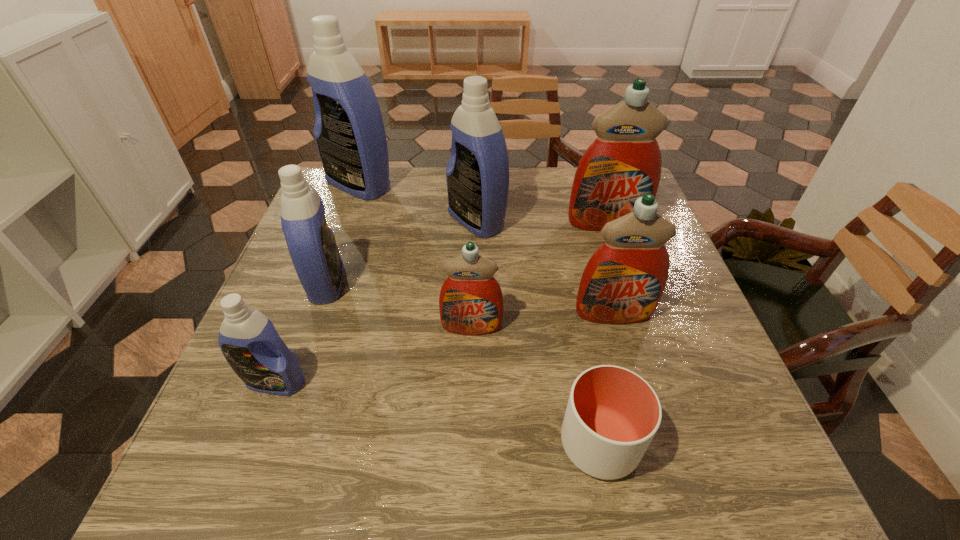
You are a GUI agent. You are given a task and a screenshot of the screen. Output one action in this format:
    pyautogui.click(x=<x>, y=<y>)
    Task: Click on the object that is positioned at the far left corner
    The height and width of the screenshot is (540, 960).
    Given the screenshot: What is the action you would take?
    pyautogui.click(x=349, y=131)

Locate an element on the screen. Image resolution: width=960 pixels, height=540 pixels. free region at the far edge of the desktop is located at coordinates (516, 167).

This screenshot has width=960, height=540. In the image, there is a desktop. Find the location of `vacant region at the near edge`. vacant region at the near edge is located at coordinates (291, 481).

I want to click on vacant space at the left edge of the desktop, so click(x=285, y=264).

In the image, there is a desktop. Where is `free space at the right edge`? The image size is (960, 540). free space at the right edge is located at coordinates (672, 414).

Identify the location of vacant region at the far left corner of the desktop. Image resolution: width=960 pixels, height=540 pixels. (343, 194).

Where is `vacant area between the biggest blue detergent and the third smallest blue detergent`? The height and width of the screenshot is (540, 960). vacant area between the biggest blue detergent and the third smallest blue detergent is located at coordinates (418, 202).

This screenshot has width=960, height=540. What are the coordinates of `free space between the second smallest red detergent and the smallest blue detergent` in the screenshot? It's located at (444, 348).

What are the coordinates of `free space between the third farthest blue detergent and the leftmost red detergent` in the screenshot? It's located at (399, 305).

I want to click on free space that is in between the biggest red detergent and the nearest object, so [603, 333].